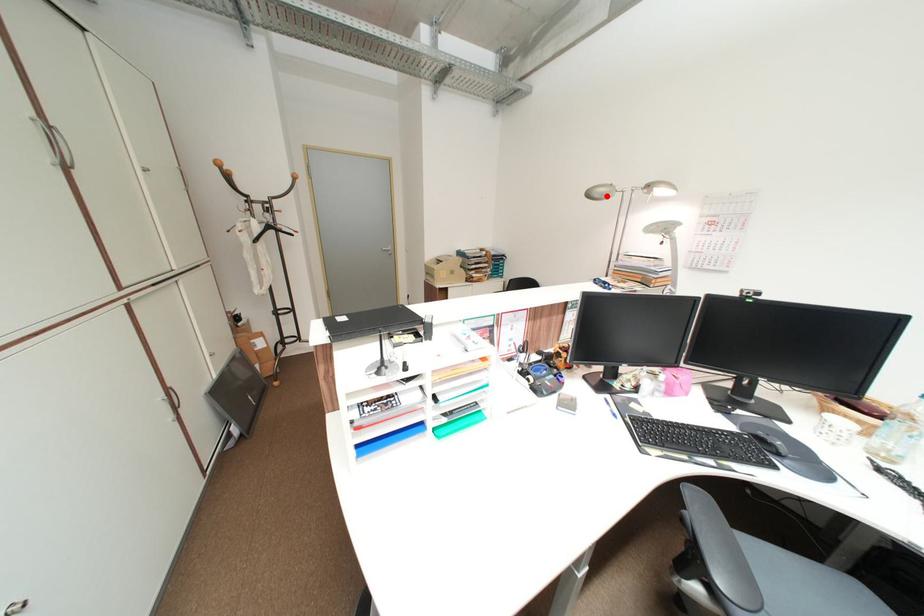
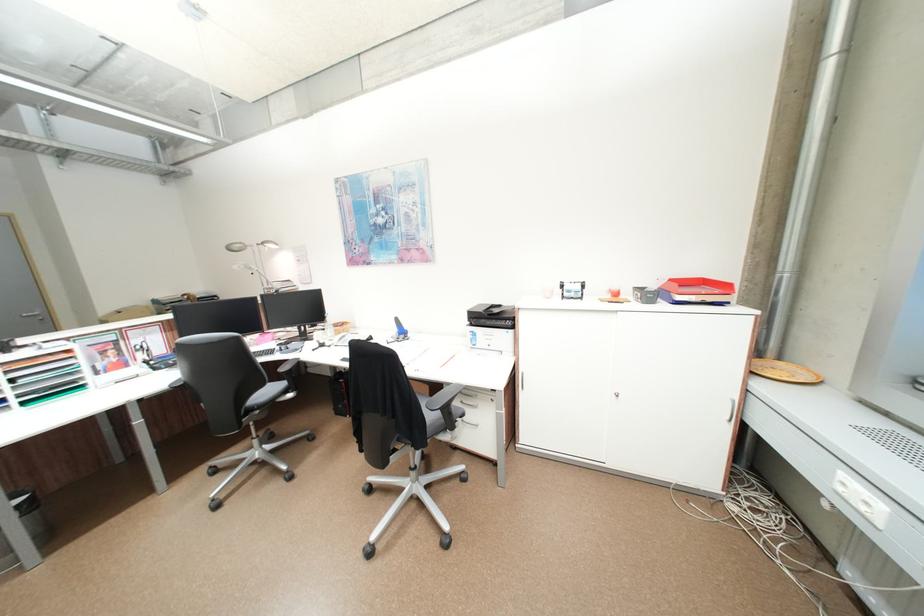
Question: I am providing you with two images of the same scene from different viewpoints. A red point is marked on the first image. At the location where the point appears in image 1, is it still visible in image 2?

Choices:
 (A) Yes
 (B) No

Answer: (A)